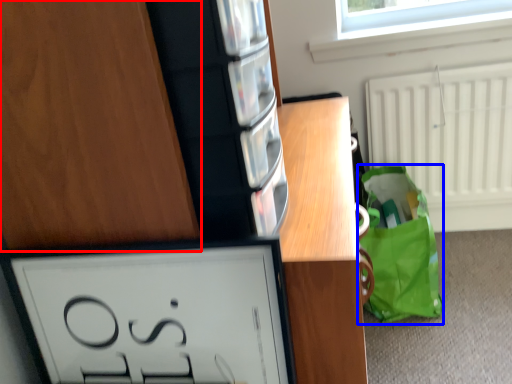
Question: Which object appears farthest to the camera in this image, cabinetry (highlighted by a red box) or tote bag (highlighted by a blue box)?

Choices:
 (A) cabinetry
 (B) tote bag

Answer: (B)